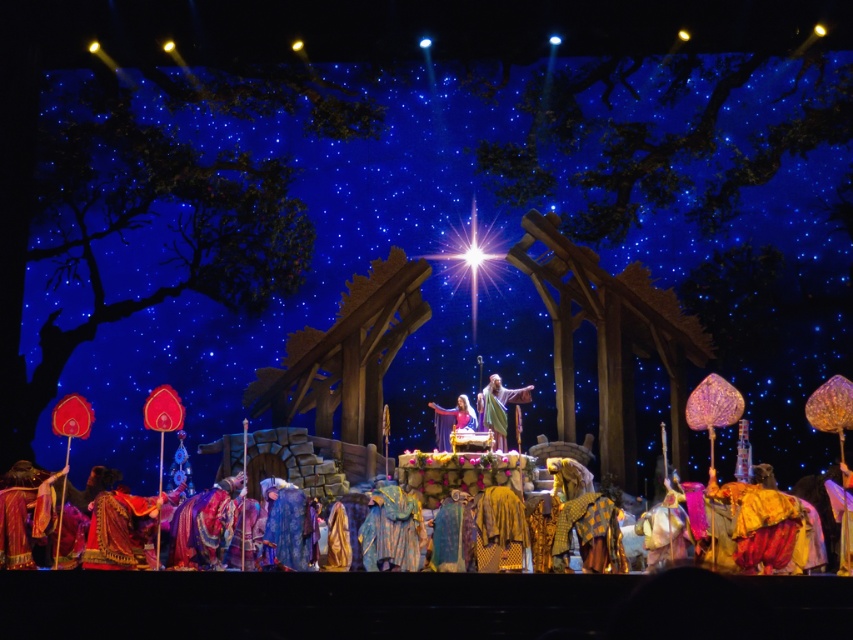
Question: Which point is closer to the camera?

Choices:
 (A) (453, 545)
 (B) (505, 413)
 (C) (123, 508)
 (D) (479, 524)

Answer: (A)

Question: Which point is closer to the camera?

Choices:
 (A) (273, 502)
 (B) (509, 516)
 (C) (589, 536)

Answer: (C)

Question: Is the position of velvet robe at lower left less distant than that of smooth golden robe at center?

Choices:
 (A) no
 (B) yes

Answer: (B)

Question: Which point appears closest to the camera in this image?

Choices:
 (A) (469, 518)
 (B) (479, 520)
 (C) (303, 516)

Answer: (B)

Question: Does golden-yellow fabric at center have a larger size compared to smooth beige robe at center?

Choices:
 (A) no
 (B) yes

Answer: (A)

Question: Can you confirm if blue velvet robe at center is bigger than golden textured robe at center?

Choices:
 (A) no
 (B) yes

Answer: (B)